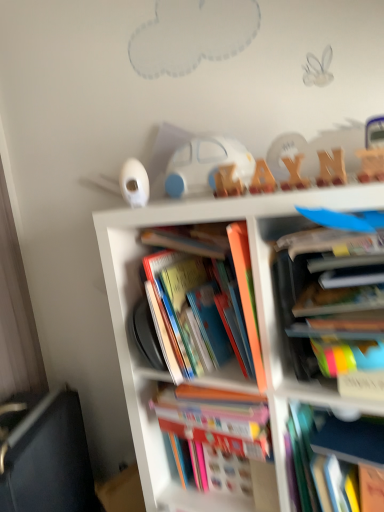
Question: Is the depth of multicolored paper book at center right, marked as the 1th book in a top-to-bottom arrangement, less than that of black fabric couch at lower left?

Choices:
 (A) no
 (B) yes

Answer: (B)

Question: Can you confirm if multicolored paper book at center right, which ranks as the fifth book in bottom-to-top order, is shorter than black fabric couch at lower left?

Choices:
 (A) no
 (B) yes

Answer: (B)

Question: Does multicolored paper book at center right, which ranks as the fifth book in bottom-to-top order, have a greater width compared to black fabric couch at lower left?

Choices:
 (A) yes
 (B) no

Answer: (A)

Question: From the image's perspective, is multicolored paper book at center right, which ranks as the fifth book in bottom-to-top order, below black fabric couch at lower left?

Choices:
 (A) yes
 (B) no

Answer: (B)

Question: Is multicolored paper book at center right, which ranks as the fifth book in bottom-to-top order, facing towards black fabric couch at lower left?

Choices:
 (A) yes
 (B) no

Answer: (B)

Question: Can we say multicolored paper book at center right, which ranks as the fifth book in bottom-to-top order, lies outside black fabric couch at lower left?

Choices:
 (A) no
 (B) yes

Answer: (B)

Question: Is hardcover book at center, the second book from the top, taller than white plastic car at upper center?

Choices:
 (A) yes
 (B) no

Answer: (A)

Question: Is hardcover book at center, marked as the fourth book in a bottom-to-top arrangement, not within white plastic car at upper center?

Choices:
 (A) no
 (B) yes

Answer: (B)

Question: Is white plastic car at upper center inside hardcover book at center, marked as the fourth book in a bottom-to-top arrangement?

Choices:
 (A) no
 (B) yes

Answer: (A)

Question: From a real-world perspective, is hardcover book at center, the second book from the top, below white plastic car at upper center?

Choices:
 (A) yes
 (B) no

Answer: (A)

Question: From a real-world perspective, is hardcover book at center, the second book from the top, on white plastic car at upper center?

Choices:
 (A) yes
 (B) no

Answer: (B)

Question: Does hardcover book at center, the second book from the top, have a lesser height compared to white plastic car at upper center?

Choices:
 (A) yes
 (B) no

Answer: (B)

Question: Can you confirm if hardcover book at center, the second book from the top, is shorter than multicolored cardboard books at center?

Choices:
 (A) yes
 (B) no

Answer: (A)